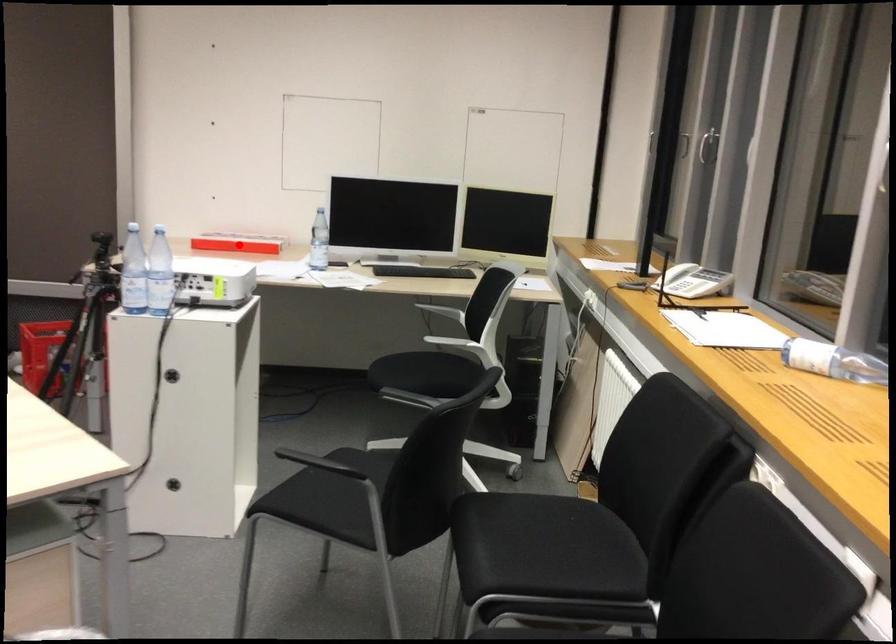
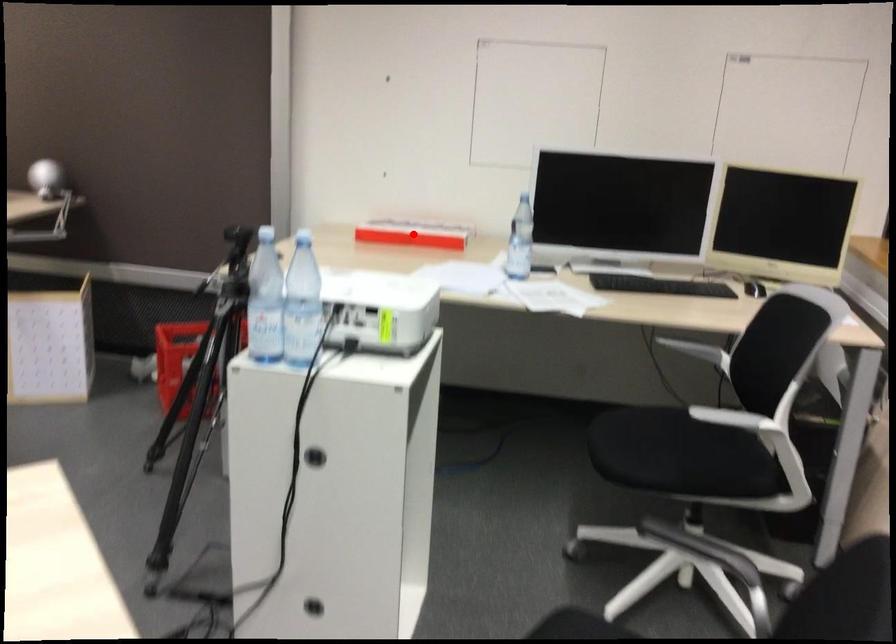
I am providing you with two images of the same scene from different viewpoints. A red point is marked on the first image and another point is marked on the second image. Is the red point in image1 aligned with the point shown in image2?

Yes